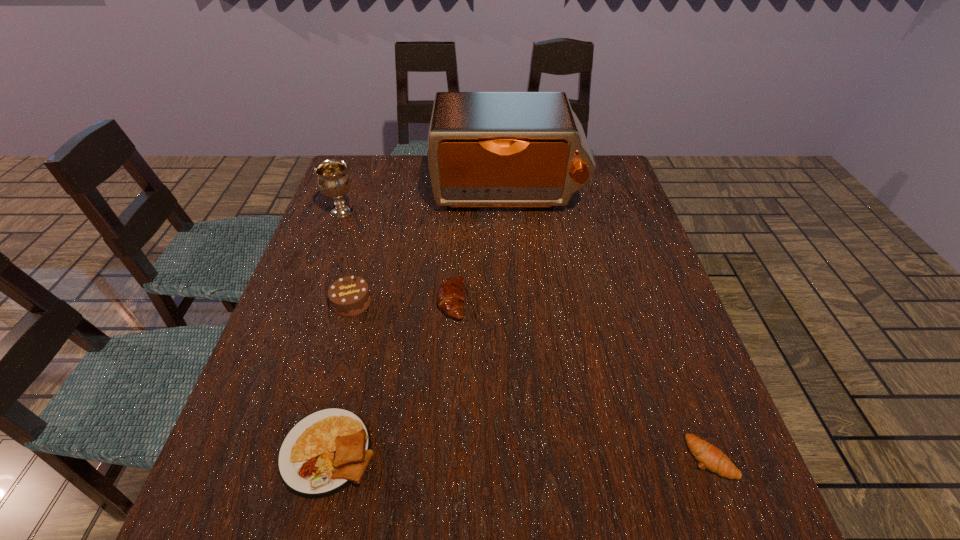
This screenshot has width=960, height=540. What are the coordinates of `toaster oven that is at the right edge` in the screenshot? It's located at (485, 149).

Identify the location of crescent roll at the right edge. The height and width of the screenshot is (540, 960). (710, 457).

Where is `object located at the near left corner`? This screenshot has width=960, height=540. object located at the near left corner is located at coordinates (322, 454).

Locate an element on the screen. object situated at the far right corner is located at coordinates click(x=485, y=149).

Image resolution: width=960 pixels, height=540 pixels. I want to click on vacant space at the far edge of the desktop, so click(x=391, y=182).

In the image, there is a desktop. Find the location of `vacant space at the near edge`. vacant space at the near edge is located at coordinates (469, 520).

Image resolution: width=960 pixels, height=540 pixels. What are the coordinates of `vacant area at the left edge of the desktop` in the screenshot? It's located at point(338,240).

Locate an element on the screen. vacant area at the right edge is located at coordinates [x=681, y=441].

In order to click on empty space between the nearer crescent roll and the fourth tallest object in this screenshot , I will do `click(581, 379)`.

Find the location of a particular element. empty location between the shorter crescent roll and the left crescent roll is located at coordinates (581, 379).